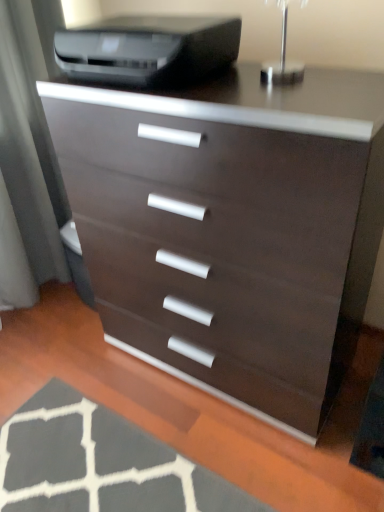
Locate an element on the screen. free point behind dark gray textured rug at lower left is located at coordinates (97, 365).